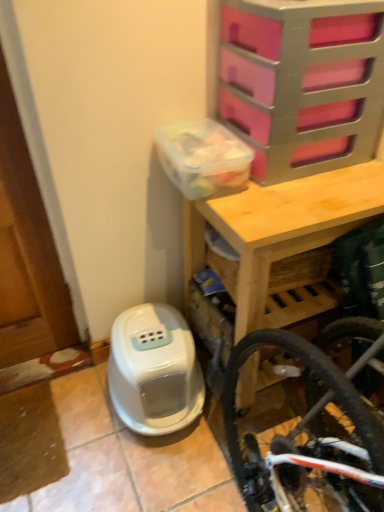
Locate an element on the screen. The image size is (384, 512). free space to the left of white plastic water heater at lower left is located at coordinates (x=62, y=420).